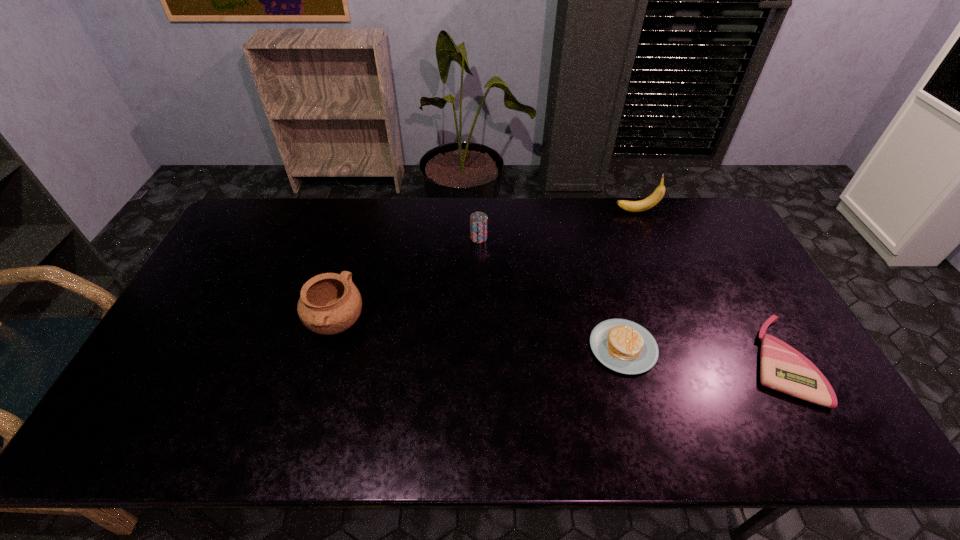
In the image, there is a desktop. At what (x,y) coordinates should I click in order to perform the action: click on vacant space at the near edge. Please return your answer as a coordinate pair (x, y). This screenshot has height=540, width=960. Looking at the image, I should click on (531, 421).

Image resolution: width=960 pixels, height=540 pixels. Find the location of `vacant space at the left edge`. vacant space at the left edge is located at coordinates (257, 242).

This screenshot has height=540, width=960. In the image, there is a desktop. Identify the location of vacant space at the right edge. (746, 280).

This screenshot has height=540, width=960. In the image, there is a desktop. In order to click on blank space at the near left corner in this screenshot , I will do `click(128, 426)`.

Image resolution: width=960 pixels, height=540 pixels. I want to click on vacant space at the far right corner, so click(x=693, y=211).

The image size is (960, 540). I want to click on empty space between the shortest object and the farthest object, so click(x=707, y=286).

The width and height of the screenshot is (960, 540). What are the coordinates of `vacant region between the rightmost object and the third object from left to right` in the screenshot? It's located at (700, 354).

The width and height of the screenshot is (960, 540). I want to click on free area in between the rightmost object and the second farthest object, so click(628, 299).

Where is `vacant area that lies between the fourth object from left to right and the pancake`? Image resolution: width=960 pixels, height=540 pixels. vacant area that lies between the fourth object from left to right and the pancake is located at coordinates pyautogui.click(x=630, y=279).

This screenshot has width=960, height=540. In order to click on unoccupied position between the pottery and the shortest object in this screenshot , I will do `click(557, 342)`.